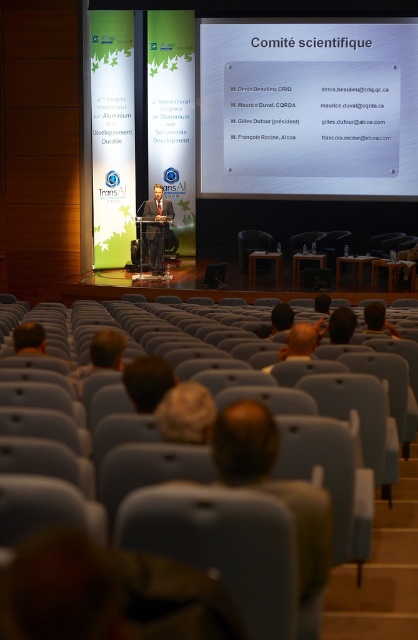
Question: Is white glossy projector screen at upper center below orange plush toy at center?

Choices:
 (A) yes
 (B) no

Answer: (B)

Question: Is white glossy projector screen at upper center further to the viewer compared to orange plush toy at center?

Choices:
 (A) yes
 (B) no

Answer: (A)

Question: Which point appears farthest from the camera in this image?

Choices:
 (A) (158, 186)
 (B) (83, 376)
 (C) (354, 145)
 (D) (321, 330)

Answer: (C)

Question: Is light brown hair at lower center to the right of orange plush toy at center from the viewer's perspective?

Choices:
 (A) no
 (B) yes

Answer: (A)

Question: Estimate the real-world distances between objects in this image. Which object is farther from the orange plush toy at center?

Choices:
 (A) light brown hair at lower center
 (B) matte black suit at center
 (C) white glossy projector screen at upper center

Answer: (C)

Question: Based on their relative distances, which object is nearer to the light brown hair at lower center?

Choices:
 (A) white glossy projector screen at upper center
 (B) matte black suit at center
 (C) orange plush toy at center

Answer: (C)